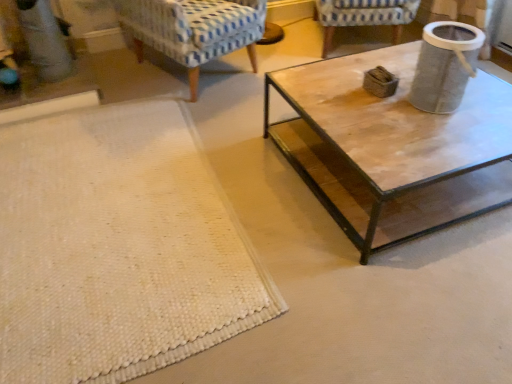
Where is `free point above white woven mat at lower left (from a real-world perspective)`? Image resolution: width=512 pixels, height=384 pixels. free point above white woven mat at lower left (from a real-world perspective) is located at coordinates (108, 221).